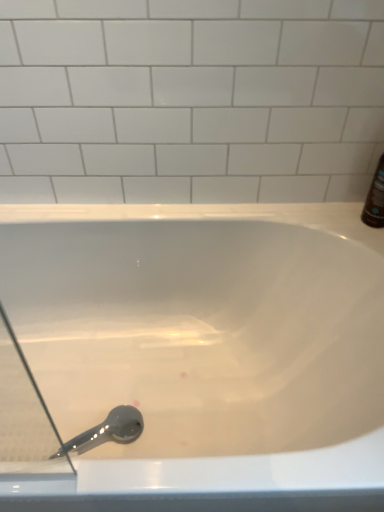
Describe the element at coordinates (204, 353) in the screenshot. I see `white glossy bathtub at center` at that location.

This screenshot has height=512, width=384. In order to click on white glossy bathtub at center in this screenshot , I will do [x=204, y=353].

Image resolution: width=384 pixels, height=512 pixels. In order to click on white glossy bathtub at center in this screenshot , I will do `click(204, 353)`.